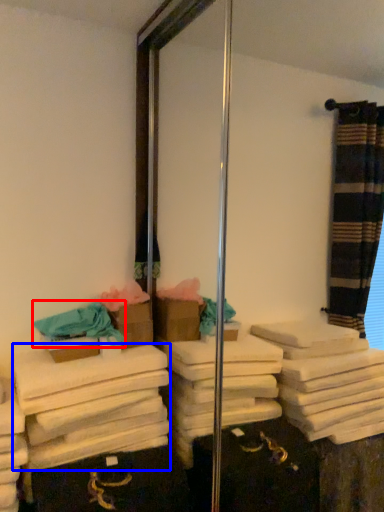
Question: Which object is closer to the camera taking this photo, bath towel (highlighted by a red box) or bath towel (highlighted by a blue box)?

Choices:
 (A) bath towel
 (B) bath towel

Answer: (B)